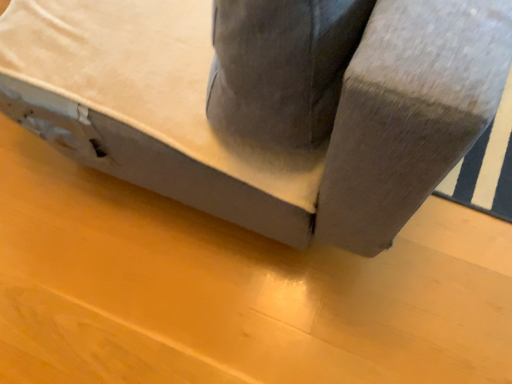
Question: From the image's perspective, is suede gray couch at center above or below matte gray plywood at lower center?

Choices:
 (A) below
 (B) above

Answer: (B)

Question: In terms of height, does suede gray couch at center look taller or shorter compared to matte gray plywood at lower center?

Choices:
 (A) short
 (B) tall

Answer: (B)

Question: Considering their positions, is suede gray couch at center located in front of or behind matte gray plywood at lower center?

Choices:
 (A) front
 (B) behind

Answer: (A)

Question: Choose the correct answer: Is matte gray plywood at lower center inside suede gray couch at center or outside it?

Choices:
 (A) inside
 (B) outside

Answer: (B)

Question: Based on their positions, is matte gray plywood at lower center located to the left or right of suede gray couch at center?

Choices:
 (A) right
 (B) left

Answer: (B)

Question: Is matte gray plywood at lower center in front of or behind suede gray couch at center in the image?

Choices:
 (A) behind
 (B) front

Answer: (A)

Question: Is matte gray plywood at lower center taller or shorter than suede gray couch at center?

Choices:
 (A) tall
 (B) short

Answer: (B)